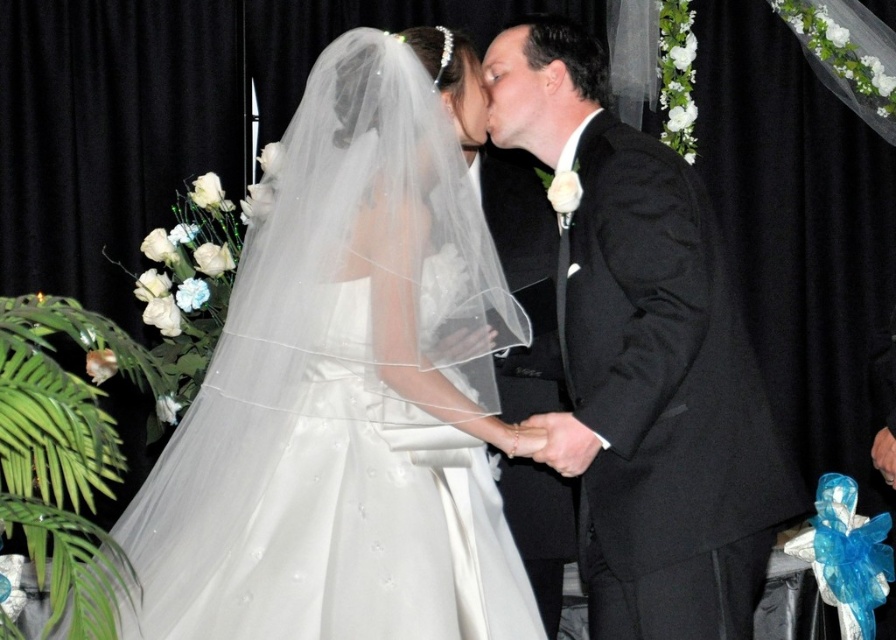
Looking at this image, you are a photographer standing at the camera position. You want to take a closeup shot of the satin white dress at center. Currently, you are 1.98 meters away from the dress. The camera has a zoom lens that can magnify objects up to 2x. To get a closer shot, you can either move closer or use the zoom. However, moving closer might disrupt the scene. What is the minimum distance you need to move closer to achieve the same magnification as using the 2x zoom?

To achieve the same magnification as a 2x zoom, you need to halve the distance. Since the current distance is 1.98 meters, moving to 0.99 meters away would provide the same effect. Therefore, you need to move 0.99 meters closer.

You are a photographer at the wedding. You need to adjust the lighting to ensure both the satin white dress at center and the black satin suit at center are well lit. Which object should you focus on first to ensure proper exposure?

The satin white dress at center is located below the black satin suit at center. Since the dress is below the suit, adjusting the lighting for the dress first would help balance the exposure between the two, as the lower position might require more light to avoid underexposure.